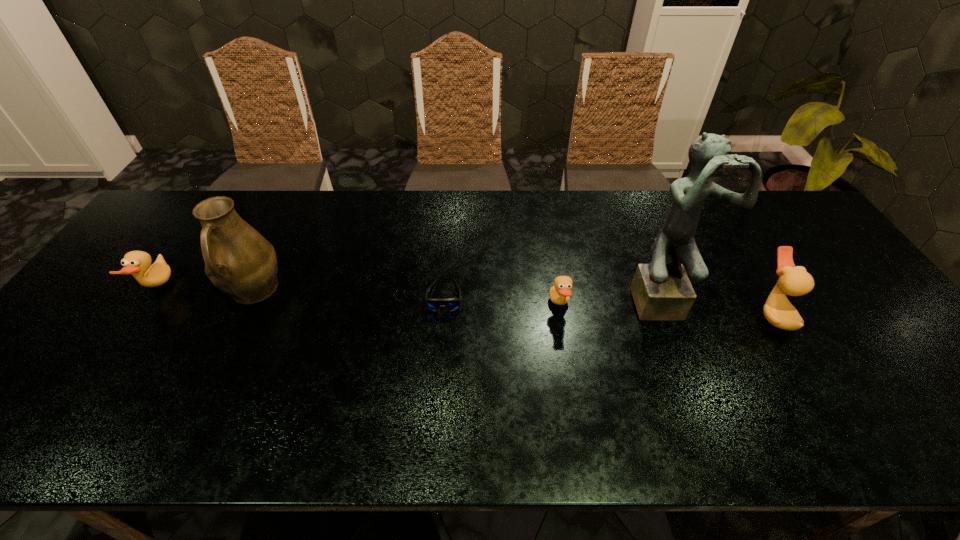
Where is `the third shortest object`? the third shortest object is located at coordinates (137, 263).

In order to click on the leftmost duck in this screenshot , I will do `click(137, 263)`.

Find the location of a particular element. The width and height of the screenshot is (960, 540). the shortest duck is located at coordinates (560, 293).

Locate an element on the screen. The width and height of the screenshot is (960, 540). the second duck from right to left is located at coordinates (560, 293).

You are a GUI agent. You are given a task and a screenshot of the screen. Output one action in this format:
    pyautogui.click(x=<x>, y=<y>)
    Task: Click on the rightmost object
    Image resolution: width=960 pixels, height=540 pixels.
    Given the screenshot: What is the action you would take?
    pyautogui.click(x=794, y=281)

Where is `the tallest duck`? The width and height of the screenshot is (960, 540). the tallest duck is located at coordinates (794, 281).

Where is `the tallest object`? This screenshot has height=540, width=960. the tallest object is located at coordinates (661, 291).

The height and width of the screenshot is (540, 960). What are the coordinates of `sculpture` in the screenshot? It's located at (661, 291).

Identify the location of pitcher. Image resolution: width=960 pixels, height=540 pixels. (239, 261).

The width and height of the screenshot is (960, 540). In order to click on the second tallest object in this screenshot , I will do `click(239, 261)`.